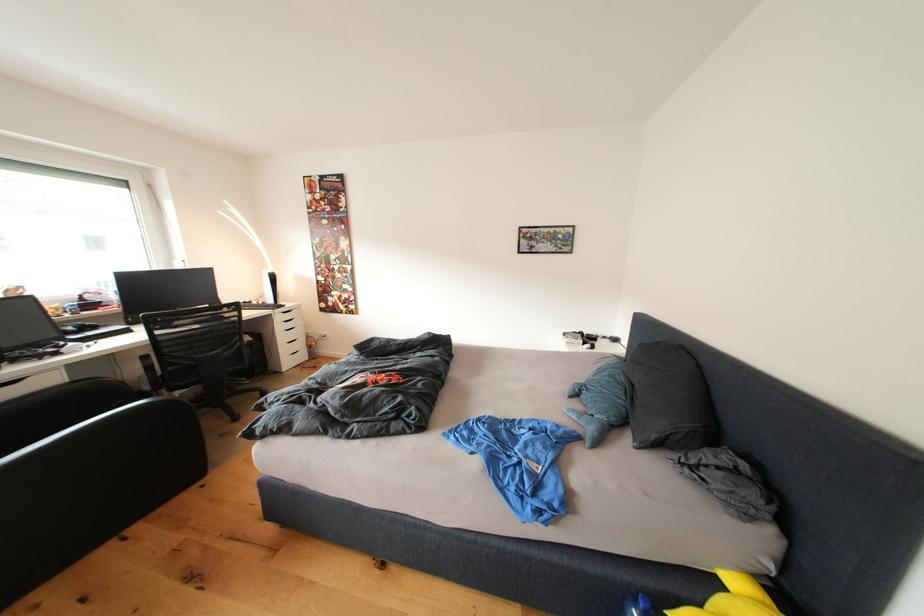
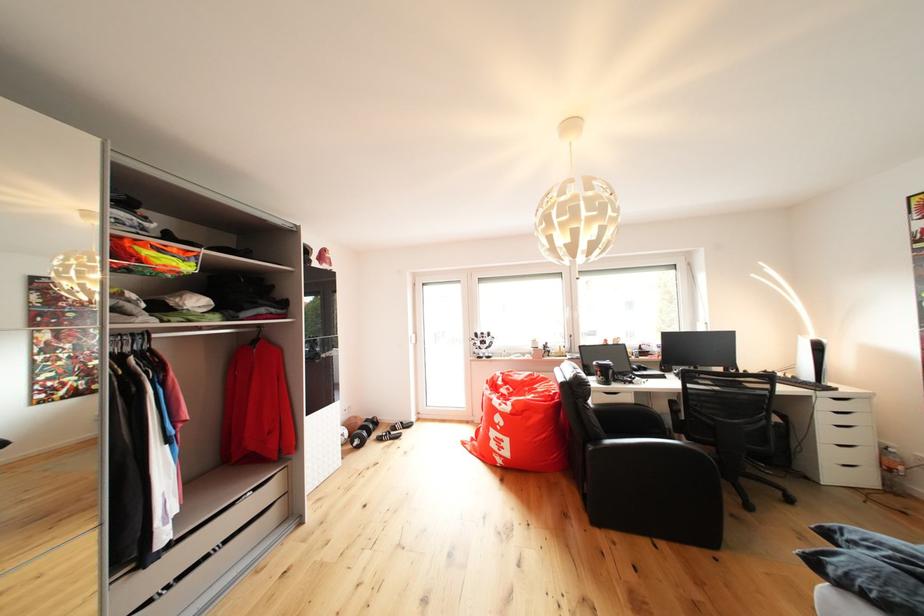
The point at (83,371) is marked in the first image. Where is the corresponding point in the second image?

(647, 399)